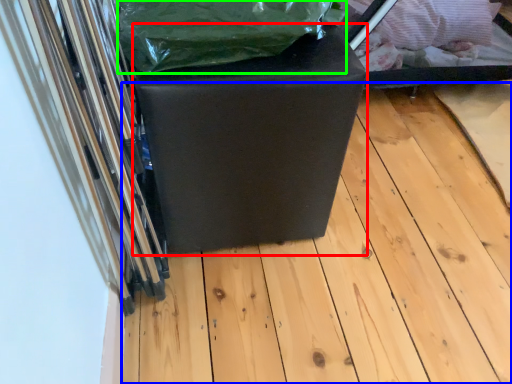
Question: Considering the real-world distances, which object is closest to furniture (highlighted by a red box)? wood (highlighted by a blue box) or waste (highlighted by a green box).

Choices:
 (A) wood
 (B) waste

Answer: (B)